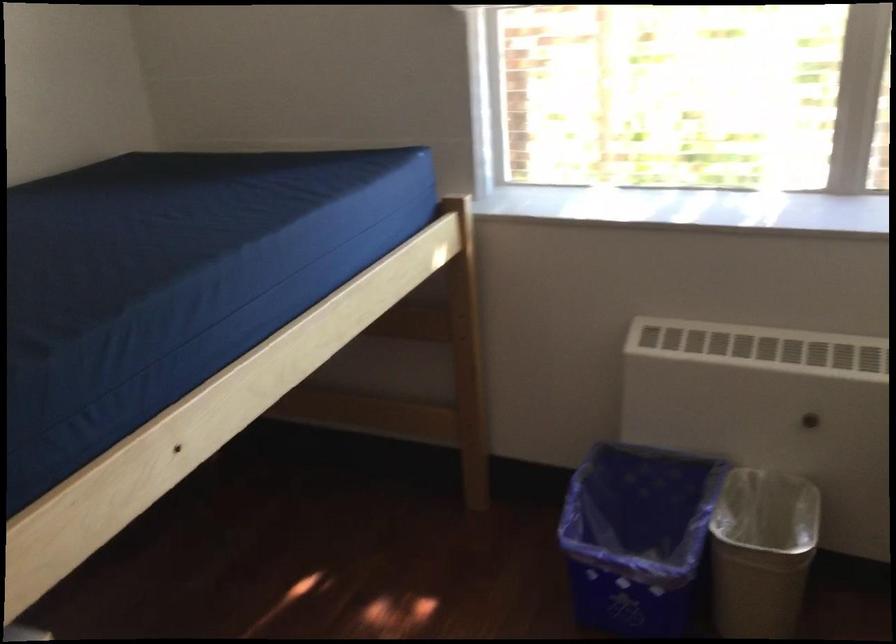
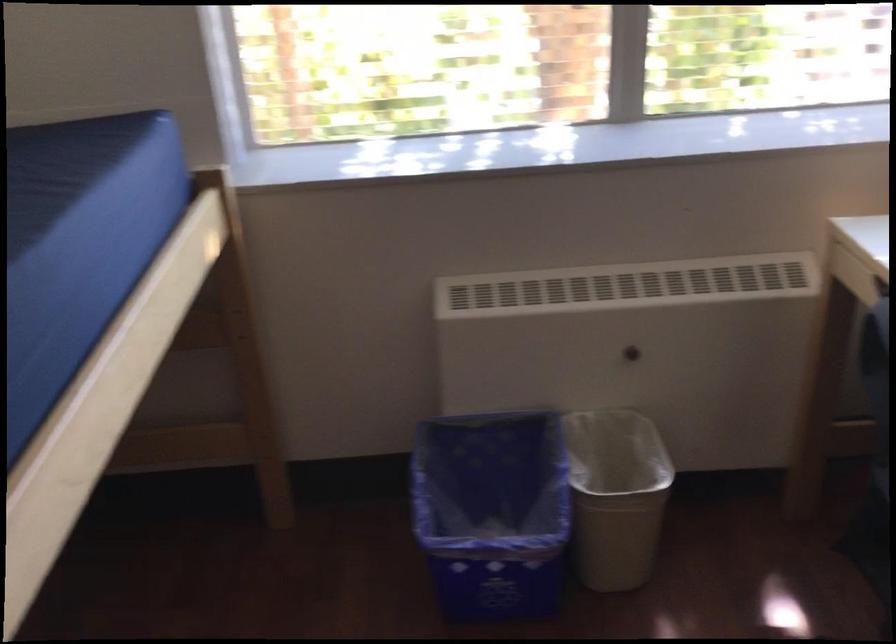
Find the pixel in the second image that matches point (814, 418) in the first image.

(634, 351)